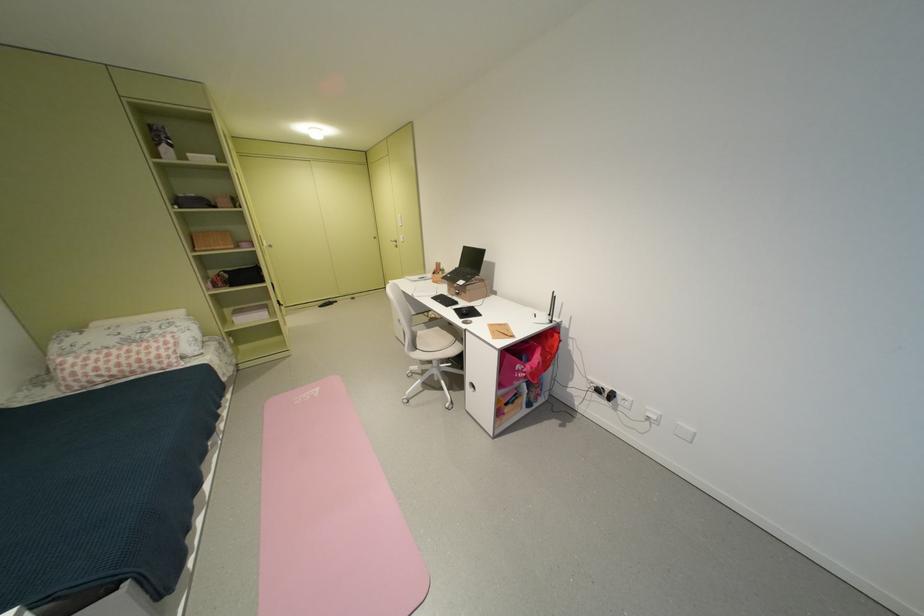
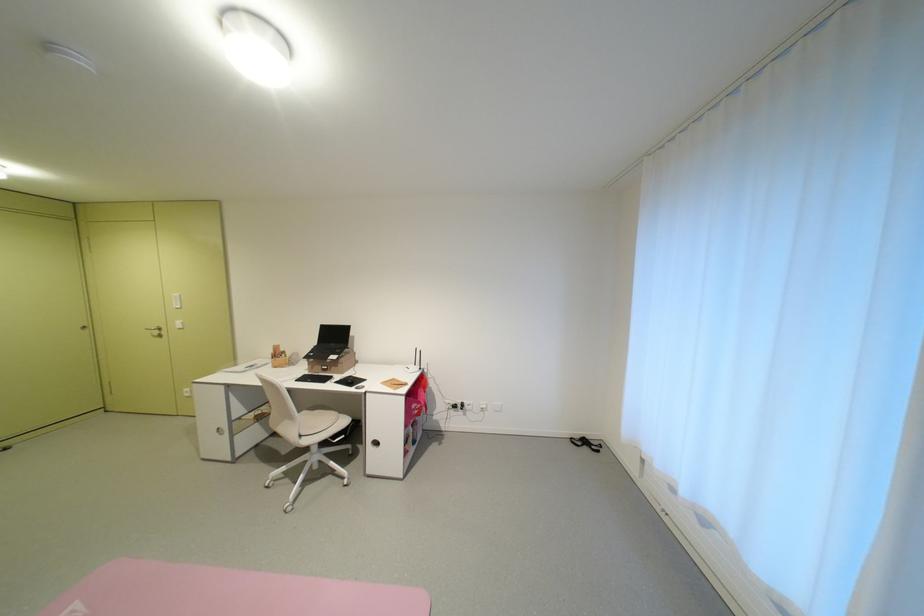
Locate, in the second image, the point that corresponds to (x=467, y=267) in the first image.

(324, 345)